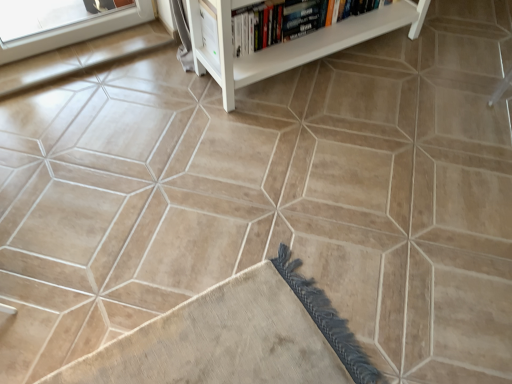
Locate an element on the screen. The image size is (512, 384). white matte shelf at upper center is located at coordinates (291, 43).

What do you see at coordinates (291, 43) in the screenshot? This screenshot has height=384, width=512. I see `white matte shelf at upper center` at bounding box center [291, 43].

You are a GUI agent. You are given a task and a screenshot of the screen. Output one action in this format:
    pyautogui.click(x=<x>, y=<y>)
    Task: Click on the white matte shelf at upper center
    
    Given the screenshot: What is the action you would take?
    pyautogui.click(x=291, y=43)